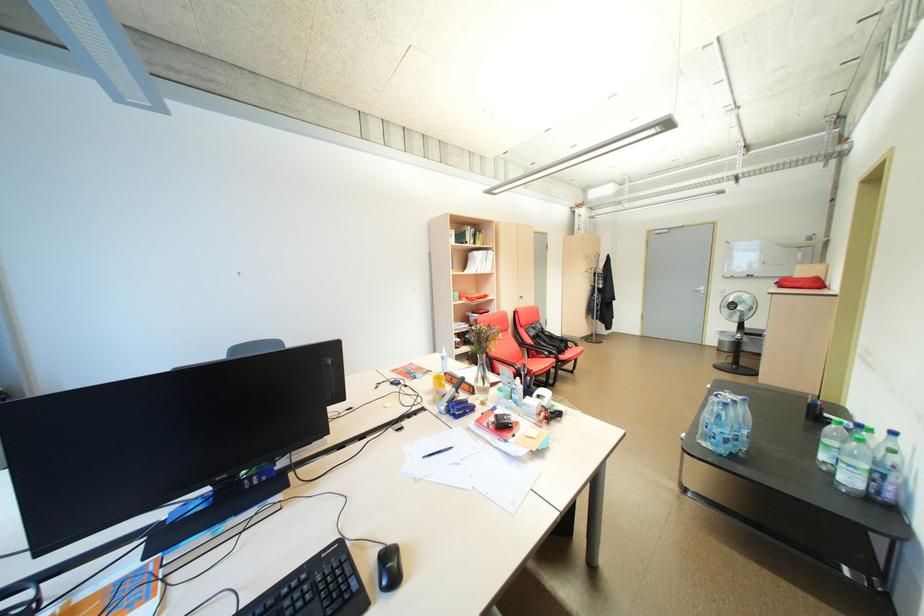
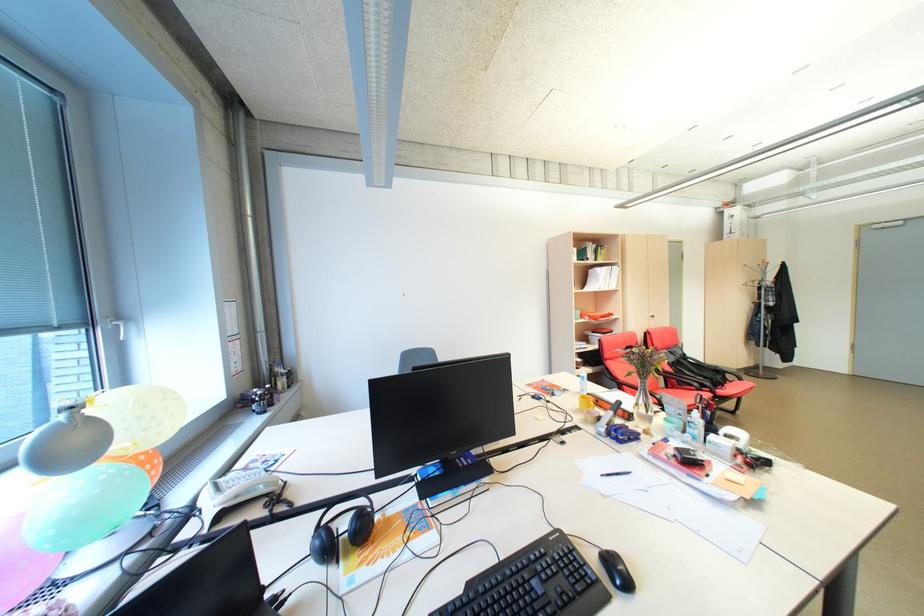
In the second image, find the point that corresponds to [570,352] in the first image.

(727, 386)